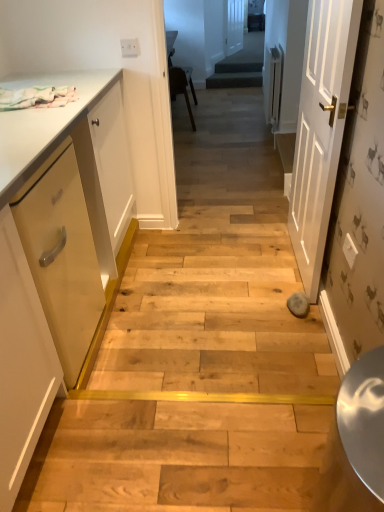
Question: From a real-world perspective, relative to matte white cabinet at left, is white painted wood door at center right, placed as the second door when sorted from back to front, vertically above or below?

Choices:
 (A) above
 (B) below

Answer: (A)

Question: Is white painted wood door at center right, the 1th door viewed from the front, to the left or to the right of matte white cabinet at left in the image?

Choices:
 (A) left
 (B) right

Answer: (B)

Question: Based on their relative distances, which object is nearer to the matte yellow drawer at left?

Choices:
 (A) dark green carpeted stairs at center
 (B) matte white cabinet at left
 (C) white wooden door at center, which appears as the second door when viewed from the front
 (D) white painted wood door at center right, placed as the second door when sorted from back to front

Answer: (B)

Question: Which object is positioned closest to the white wooden door at center, which appears as the second door when viewed from the front?

Choices:
 (A) white painted wood door at center right, acting as the second door starting from the top
 (B) matte white cabinet at left
 (C) dark green carpeted stairs at center
 (D) matte yellow drawer at left

Answer: (C)